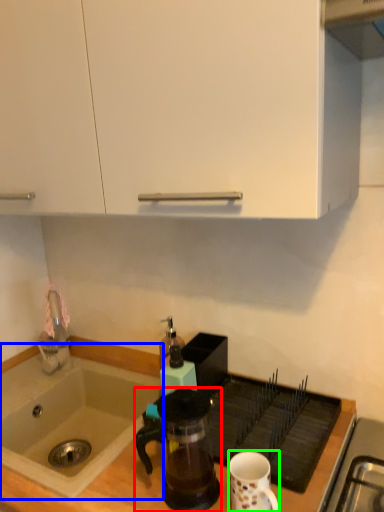
Question: Which is farther away from coffee maker (highlighted by a red box)? sink (highlighted by a blue box) or coffee cup (highlighted by a green box)?

Choices:
 (A) sink
 (B) coffee cup

Answer: (A)